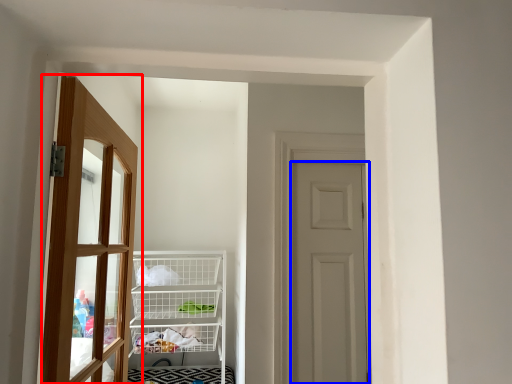
Question: Which of the following is the closest to the observer, door (highlighted by a red box) or door (highlighted by a blue box)?

Choices:
 (A) door
 (B) door

Answer: (A)